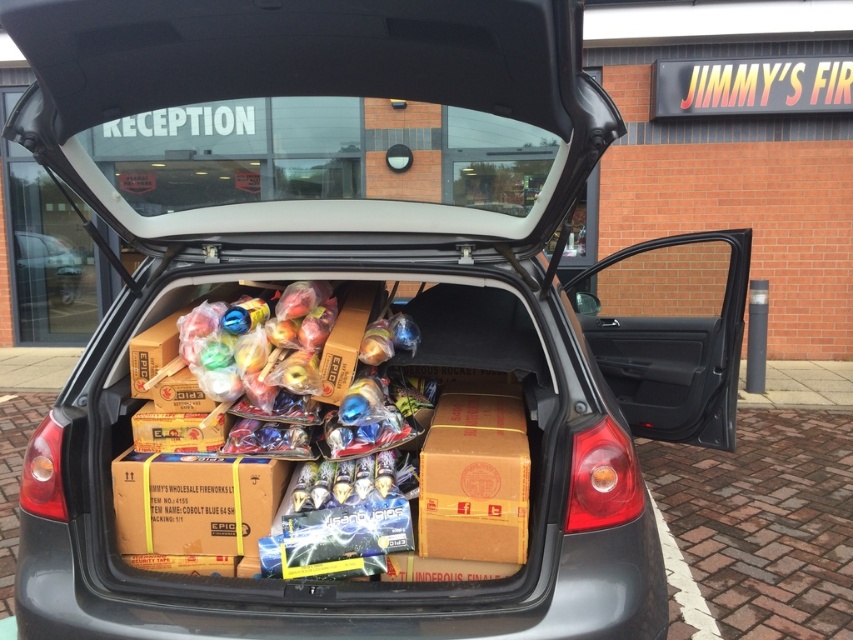
Is brown cardboard box at center wider than matte cardboard boxes at center?

No, brown cardboard box at center is not wider than matte cardboard boxes at center.

Is brown cardboard box at center below matte cardboard boxes at center?

Yes.

What do you see at coordinates (474, 480) in the screenshot?
I see `brown cardboard box at center` at bounding box center [474, 480].

Locate an element on the screen. This screenshot has width=853, height=640. brown cardboard box at center is located at coordinates (474, 480).